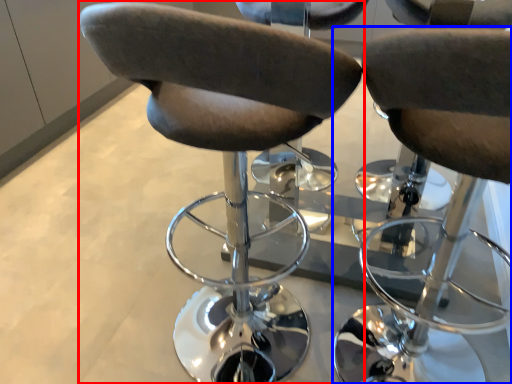
Question: Among these objects, which one is nearest to the camera, chair (highlighted by a red box) or chair (highlighted by a blue box)?

Choices:
 (A) chair
 (B) chair

Answer: (B)